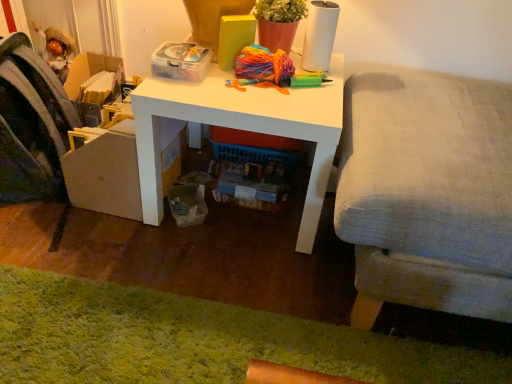
At what (x,y) coordinates should I click in order to perform the action: click on vacant space in front of white matte desk at center. Please return your answer as a coordinate pair (x, y). Image resolution: width=512 pixels, height=384 pixels. Looking at the image, I should click on (211, 266).